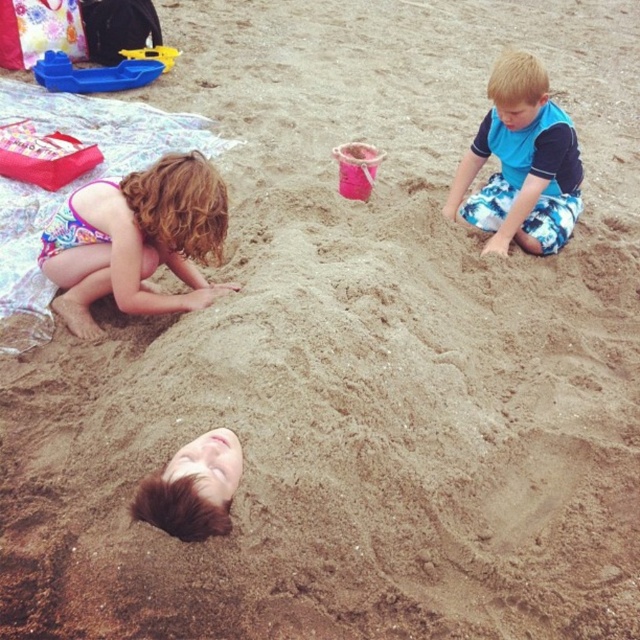
Question: Which point appears farthest from the camera in this image?

Choices:
 (A) (220, 180)
 (B) (477, 157)

Answer: (B)

Question: Is multicolored swimsuit at lower left closer to the viewer compared to blue camouflage shorts at upper right?

Choices:
 (A) no
 (B) yes

Answer: (B)

Question: Does multicolored swimsuit at lower left have a greater width compared to blue camouflage shorts at upper right?

Choices:
 (A) yes
 (B) no

Answer: (A)

Question: Among these points, which one is nearest to the camera?

Choices:
 (A) (564, 145)
 (B) (113, 195)

Answer: (B)

Question: Where is multicolored swimsuit at lower left located in relation to blue camouflage shorts at upper right in the image?

Choices:
 (A) below
 (B) above

Answer: (A)